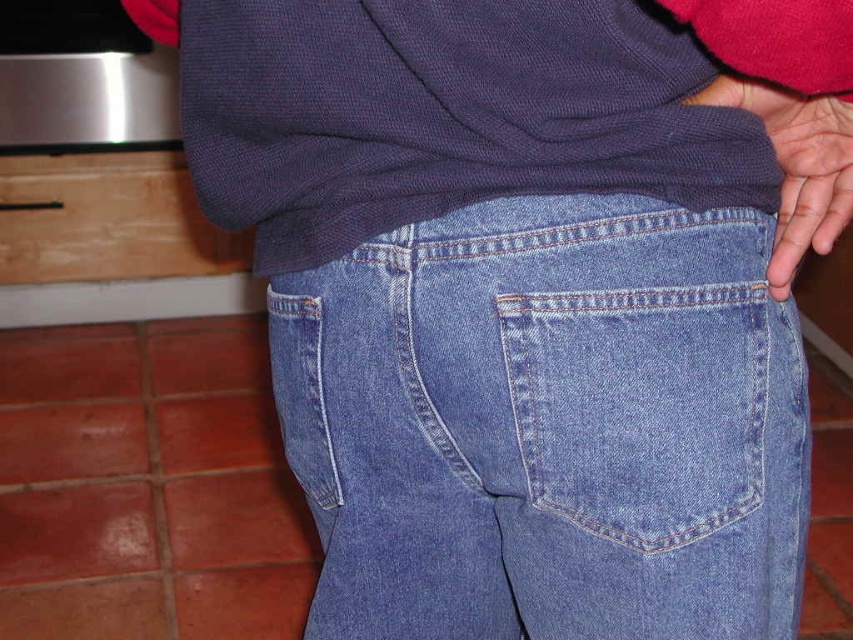
Which of these two, denim blue jeans pocket at center or matte blue jeans at lower right, stands shorter?

With less height is matte blue jeans at lower right.

From the picture: Who is more distant from viewer, (595, 326) or (804, 211)?

Positioned behind is point (804, 211).

This screenshot has height=640, width=853. Identify the location of denim blue jeans pocket at center. (641, 406).

Can you confirm if denim blue jeans at center is wider than matte blue jeans at lower right?

Correct, the width of denim blue jeans at center exceeds that of matte blue jeans at lower right.

Is point (401, 512) closer to camera compared to point (846, 211)?

No, it is behind (846, 211).

Describe the element at coordinates (548, 426) in the screenshot. I see `denim blue jeans at center` at that location.

I want to click on denim blue jeans at center, so click(548, 426).

From the picture: Can you confirm if denim blue jeans at center is positioned above denim blue jeans pocket at center?

Actually, denim blue jeans at center is below denim blue jeans pocket at center.

Does denim blue jeans at center appear on the left side of denim blue jeans pocket at center?

Correct, you'll find denim blue jeans at center to the left of denim blue jeans pocket at center.

Is point (492, 288) farther from viewer compared to point (711, 332)?

Yes, point (492, 288) is behind point (711, 332).

You are a GUI agent. You are given a task and a screenshot of the screen. Output one action in this format:
    pyautogui.click(x=<x>, y=<y>)
    Task: Click on the denim blue jeans at center
    The height and width of the screenshot is (640, 853).
    Given the screenshot: What is the action you would take?
    pyautogui.click(x=548, y=426)